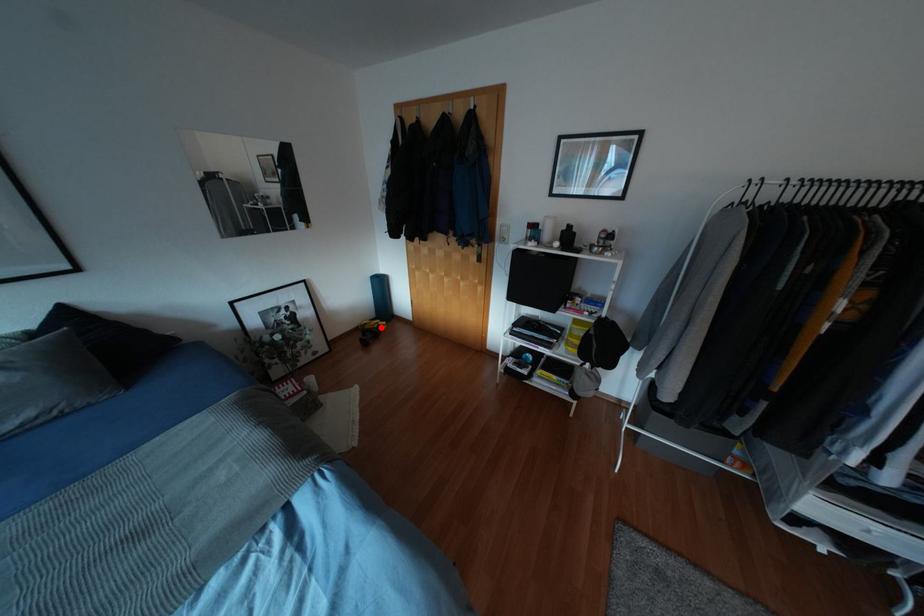
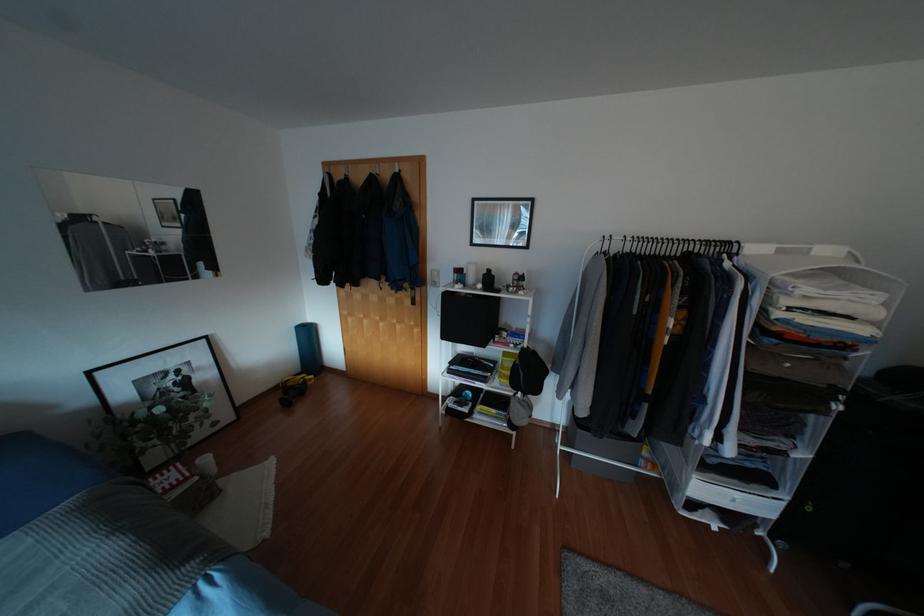
The point at the highlighted location is marked in the first image. Where is the corresponding point in the second image?

(309, 383)